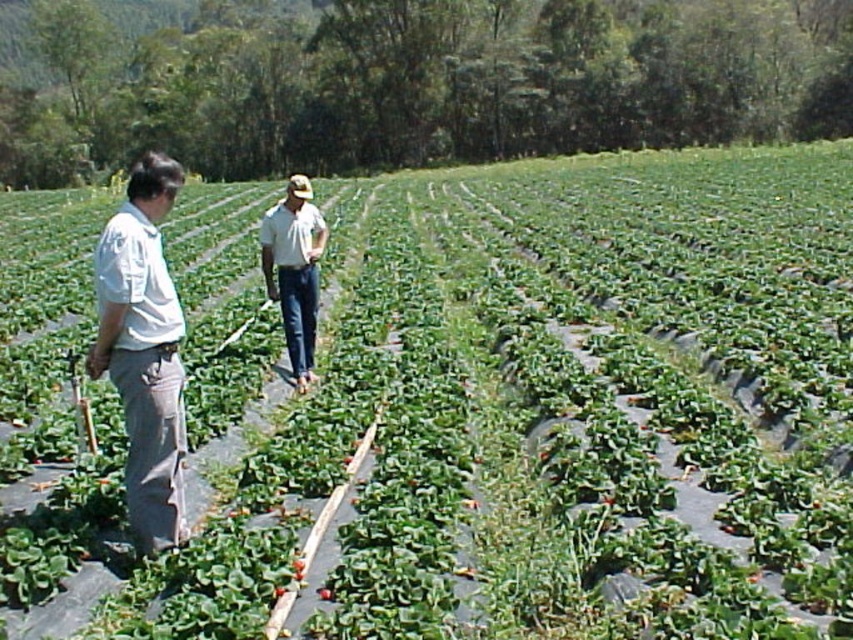
From the picture: Is white cotton shirt at left thinner than denim jeans at center?

Incorrect, white cotton shirt at left's width is not less than denim jeans at center's.

Is point (103, 256) positioned after point (303, 180)?

No, it is in front of (303, 180).

This screenshot has height=640, width=853. I want to click on white cotton shirt at left, so click(x=144, y=349).